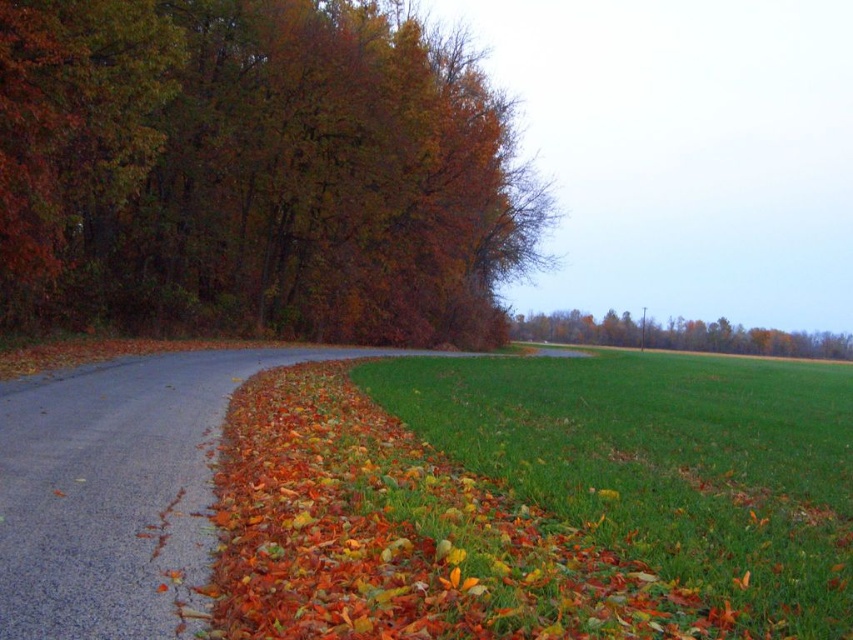
Who is taller, autumn leaves at left or green grass at lower right?

Standing taller between the two is autumn leaves at left.

Can you confirm if autumn leaves at left is smaller than green grass at lower right?

Actually, autumn leaves at left might be larger than green grass at lower right.

The height and width of the screenshot is (640, 853). I want to click on autumn leaves at left, so click(x=253, y=172).

Where is `autumn leaves at left`? The image size is (853, 640). autumn leaves at left is located at coordinates (253, 172).

How distant is green grass at lower right from green leafy tree at center?

green grass at lower right and green leafy tree at center are 225.50 feet apart.

Which is behind, point (433, 435) or point (569, 324)?

The point (569, 324) is more distant.

The image size is (853, 640). What do you see at coordinates (665, 465) in the screenshot?
I see `green grass at lower right` at bounding box center [665, 465].

This screenshot has height=640, width=853. I want to click on green grass at lower right, so click(665, 465).

Can you confirm if gray asphalt road at lower left is wider than green leafy tree at center?

No.

Does gray asphalt road at lower left have a larger size compared to green leafy tree at center?

No.

I want to click on gray asphalt road at lower left, so click(119, 490).

At what (x,y) coordinates should I click in order to perform the action: click on gray asphalt road at lower left. Please return your answer as a coordinate pair (x, y). The width and height of the screenshot is (853, 640). Looking at the image, I should click on (119, 490).